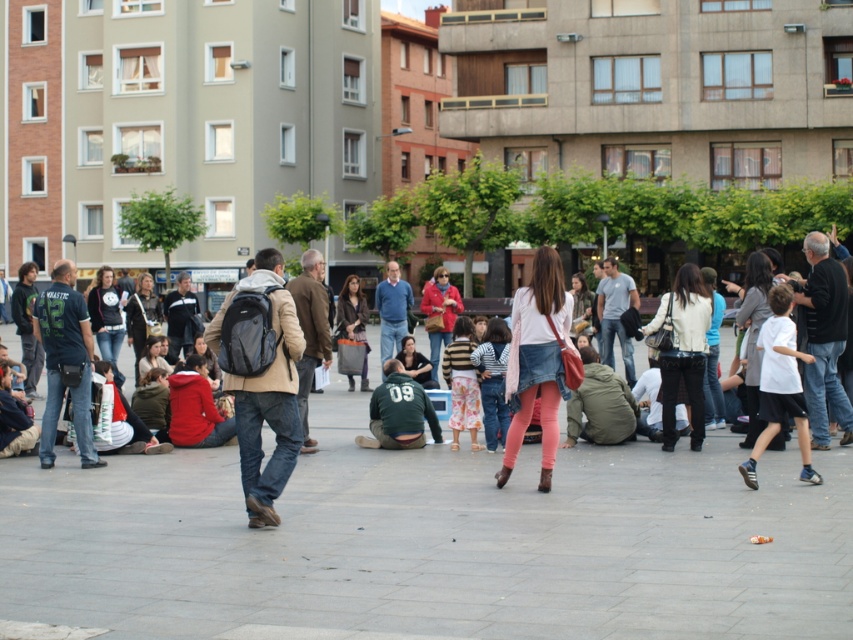
Question: Among these objects, which one is farthest from the camera?

Choices:
 (A) white cotton shirt at right
 (B) blue sweater at center
 (C) green matte jacket at center
 (D) matte black backpack at center

Answer: (B)

Question: Does denim skirt at center appear under white cotton shirt at right?

Choices:
 (A) no
 (B) yes

Answer: (B)

Question: Considering the relative positions of dark green t-shirt at left and white cotton shirt at right in the image provided, where is dark green t-shirt at left located with respect to white cotton shirt at right?

Choices:
 (A) below
 (B) above

Answer: (A)

Question: Among these objects, which one is nearest to the camera?

Choices:
 (A) green matte jacket at center
 (B) matte black backpack at center
 (C) blue sweater at center

Answer: (B)

Question: Does dark green t-shirt at left have a greater width compared to blue sweater at center?

Choices:
 (A) yes
 (B) no

Answer: (A)

Question: Considering the real-world distances, which object is farthest from the denim skirt at center?

Choices:
 (A) green matte jacket at center
 (B) dark green t-shirt at left
 (C) blue sweater at center

Answer: (C)